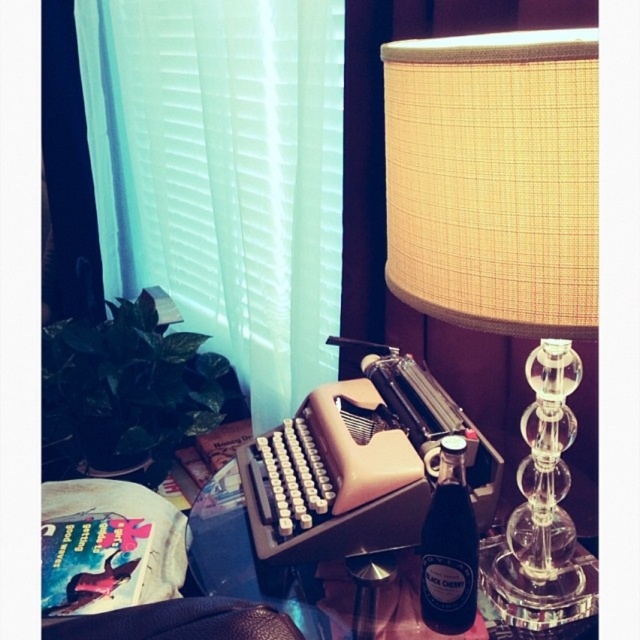
You are a person who wants to place a small statue on the tallest object in the scene. Which object should you choose between the translucent glass table at center and the leather at lower left?

The translucent glass table at center is taller than the leather at lower left, so you should place the small statue on the translucent glass table at center.

You are an interior designer planning to install a new light fixture in this room. You have the beige fabric lampshade at upper right and the mint green sheer curtain at left. Based on their current positions, which object is closer to the viewer?

The mint green sheer curtain at left is closer to the viewer because the beige fabric lampshade at upper right is positioned behind it.